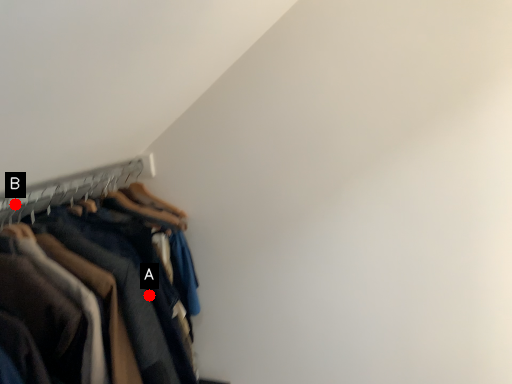
Question: Two points are circled on the image, labeled by A and B beside each circle. Which point is farther from the camera taking this photo?

Choices:
 (A) A is further
 (B) B is further

Answer: (B)